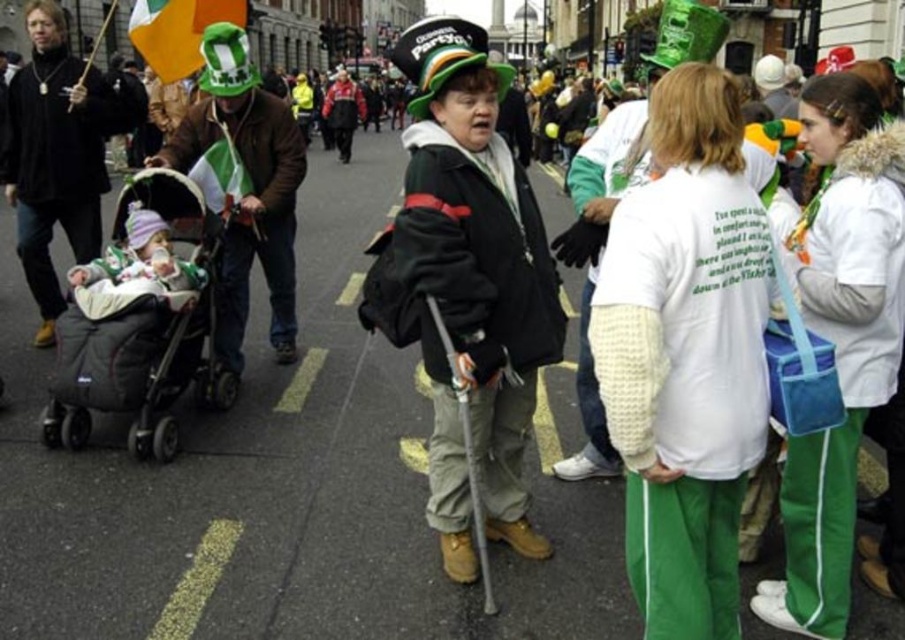
Is white knitted sweater at center wider than matte black jacket at center?

In fact, white knitted sweater at center might be narrower than matte black jacket at center.

I want to click on white knitted sweater at center, so click(x=684, y=385).

Find the location of a particular element. This screenshot has width=905, height=640. white knitted sweater at center is located at coordinates (684, 385).

Which is behind, point (162, 296) or point (272, 136)?

Positioned behind is point (272, 136).

At what (x,y) coordinates should I click in order to perform the action: click on gray fabric stroller at left. Please return your answer as a coordinate pair (x, y). The height and width of the screenshot is (640, 905). Looking at the image, I should click on (140, 321).

Can you confirm if shiny green hat at left is taller than matte green hat at upper left?

No, shiny green hat at left is not taller than matte green hat at upper left.

Between point (226, 65) and point (27, 227), which one is positioned behind?

Point (27, 227)

Where is `shiny green hat at left`? The height and width of the screenshot is (640, 905). shiny green hat at left is located at coordinates (245, 186).